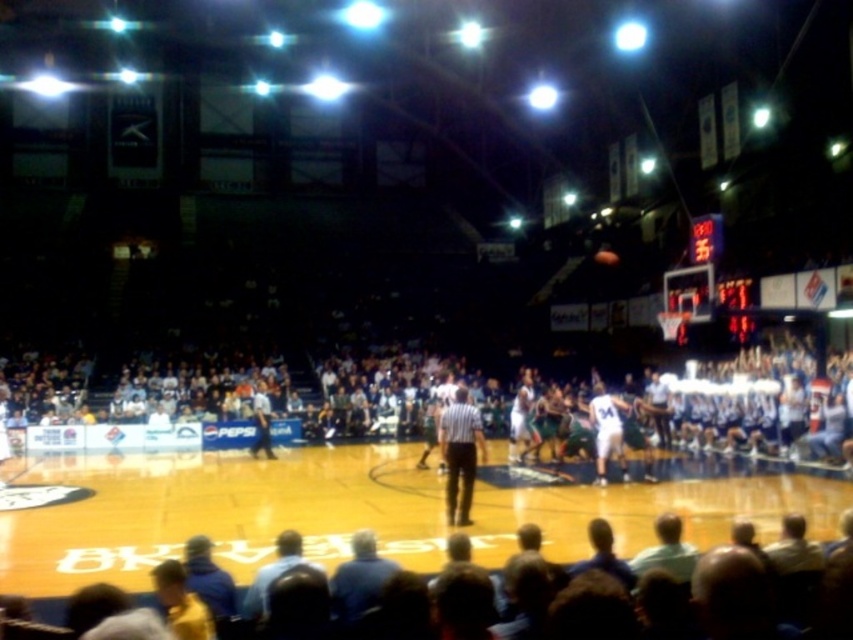
You are a spectator sitting in the arena and want to take a photo of the wooden polished basketball court at center and the light blue shirt at lower center. Based on their positions, which object should you point your camera towards first to capture both in the frame?

The wooden polished basketball court at center is to the left of light blue shirt at lower center, so you should point your camera towards the wooden polished basketball court at center first to include both in the frame.

You are a photographer positioned at the back of the arena. You want to take a photo of the light blue shirt at lower center without the wooden polished basketball court at center blocking the view. Is this possible?

The light blue shirt at lower center is behind the wooden polished basketball court at center, so it would be blocked from view. You cannot take a photo of it without the court blocking the view.

You are a photographer at the basketball game. You want to take a photo that includes both the wooden polished basketball court at center and the light blue shirt at lower center. Which object should you focus on first to ensure both are in frame?

The wooden polished basketball court at center is larger in size than the light blue shirt at lower center, so you should focus on the wooden polished basketball court at center first to ensure both fit in the frame.